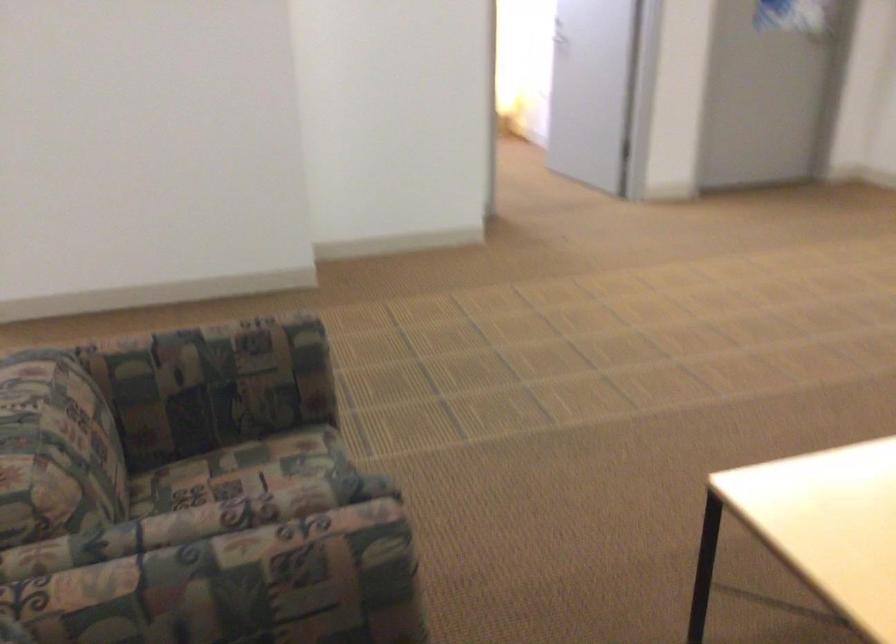
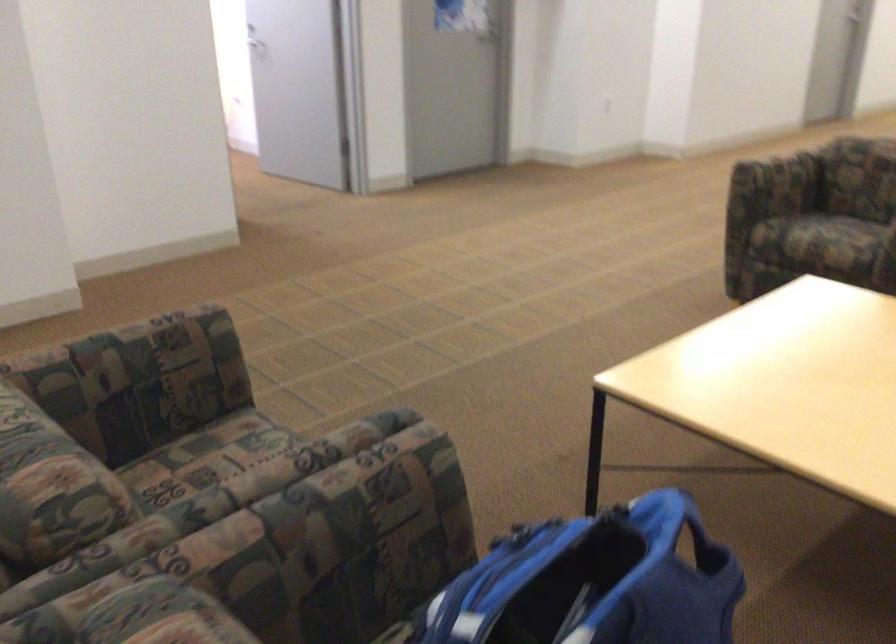
Question: In a continuous first-person perspective shot, in which direction is the camera moving?

Choices:
 (A) Left
 (B) Right
 (C) Forward
 (D) Backward

Answer: (A)